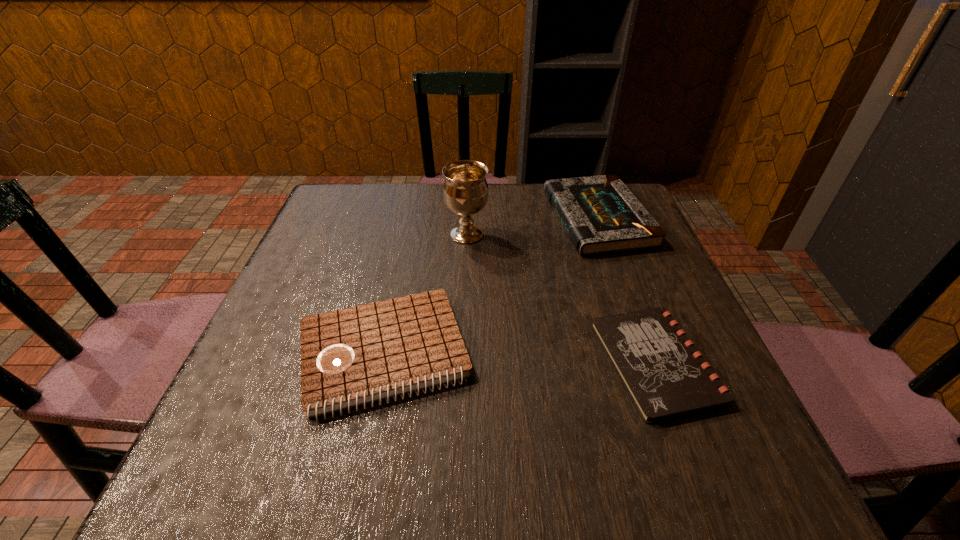
Locate an element on the screen. The height and width of the screenshot is (540, 960). the tallest object is located at coordinates (465, 191).

Identify the location of the third shortest object. Image resolution: width=960 pixels, height=540 pixels. (601, 215).

The width and height of the screenshot is (960, 540). I want to click on the tallest notebook, so click(601, 215).

Where is `the second shortest notebook`? The width and height of the screenshot is (960, 540). the second shortest notebook is located at coordinates (353, 356).

The image size is (960, 540). Identify the location of the leftmost notebook. (353, 356).

Where is `the shortest notebook`? The height and width of the screenshot is (540, 960). the shortest notebook is located at coordinates (665, 376).

Find the location of a particular element. The image size is (960, 540). free location located 0.370m on the right of the chalice is located at coordinates (637, 234).

You are a GUI agent. You are given a task and a screenshot of the screen. Output one action in this format:
    pyautogui.click(x=<x>, y=<y>)
    Task: Click on the vacant space located on the front of the third shortest object
    This screenshot has height=540, width=960.
    Given the screenshot: What is the action you would take?
    pyautogui.click(x=656, y=379)

At what (x,y) coordinates should I click in order to perform the action: click on vacant region located 0.300m on the back of the leftmost notebook. Please return your answer as a coordinate pair (x, y). Looking at the image, I should click on (412, 219).

Locate an element on the screen. Image resolution: width=960 pixels, height=540 pixels. vacant space positioned 0.050m on the back of the shortest object is located at coordinates (630, 296).